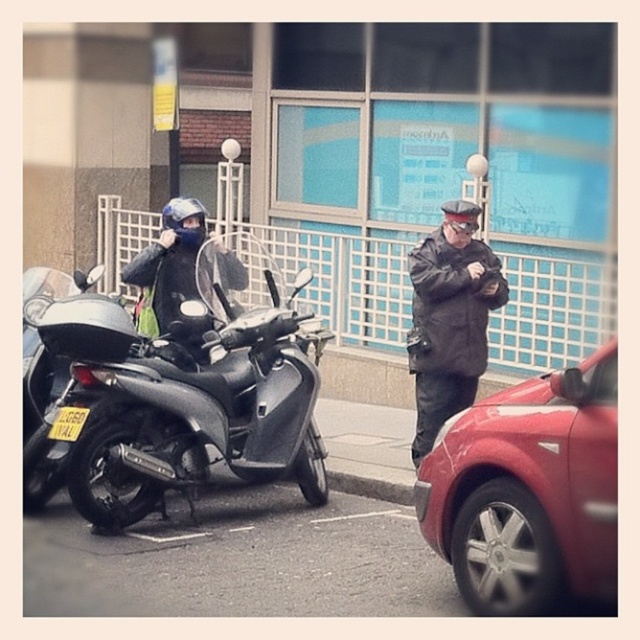
Question: Considering the real-world distances, which object is closest to the metallic red car at right?

Choices:
 (A) black leather jacket at center
 (B) matte black scooter at left

Answer: (A)

Question: In this image, where is matte black scooter at left located relative to metallic red car at right?

Choices:
 (A) right
 (B) left

Answer: (B)

Question: Among these points, which one is farthest from the camera?

Choices:
 (A) coord(134,461)
 (B) coord(483,548)
 (C) coord(422,314)

Answer: (C)

Question: Can you confirm if matte black scooter at left is wider than black leather jacket at center?

Choices:
 (A) no
 (B) yes

Answer: (B)

Question: Considering the relative positions of matte black scooter at left and black leather jacket at center in the image provided, where is matte black scooter at left located with respect to black leather jacket at center?

Choices:
 (A) below
 (B) above

Answer: (A)

Question: Which point is closer to the camera?

Choices:
 (A) (516, 588)
 (B) (120, 426)
 (C) (440, 266)

Answer: (A)